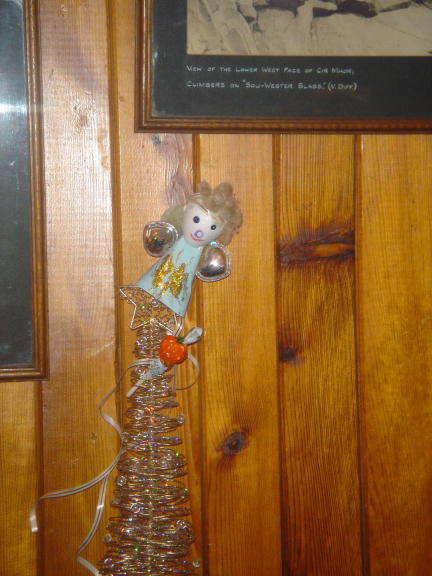
Find the location of a particular element. The image size is (432, 576). strawberry ornament is located at coordinates (174, 351).